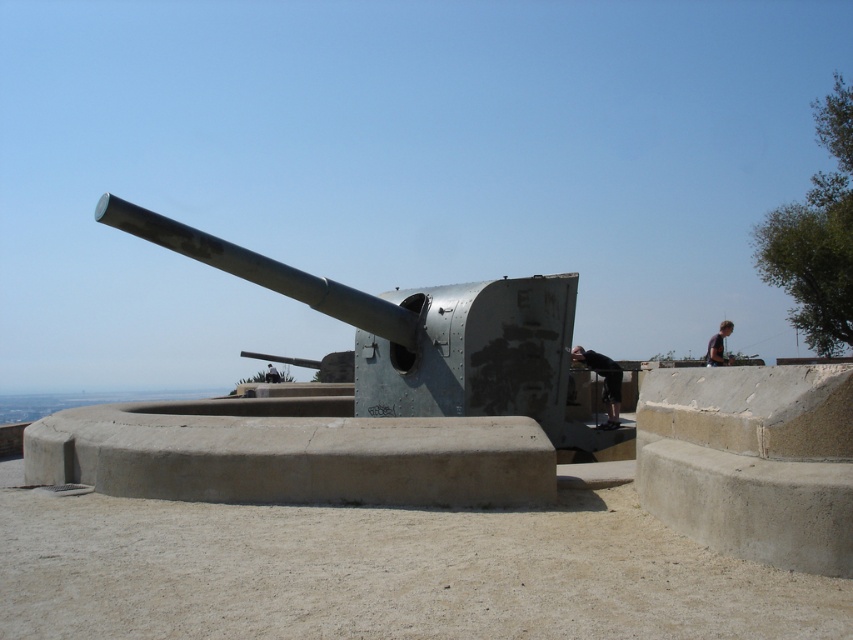
Which is more to the right, shiny metallic cannon at center or black matte pants at lower center?

black matte pants at lower center

Can you confirm if shiny metallic cannon at center is positioned below black matte pants at lower center?

No, shiny metallic cannon at center is not below black matte pants at lower center.

Is point (213, 253) farther from camera compared to point (605, 397)?

That is False.

Image resolution: width=853 pixels, height=640 pixels. In order to click on shiny metallic cannon at center in this screenshot , I will do `click(418, 332)`.

Describe the element at coordinates (602, 381) in the screenshot. The image size is (853, 640). I see `black matte pants at lower center` at that location.

Is black matte pants at lower center smaller than dark blue shirt at upper right?

Yes.

Where is `black matte pants at lower center`? This screenshot has width=853, height=640. black matte pants at lower center is located at coordinates (602, 381).

Does point (399, 342) lie in front of point (721, 362)?

Yes, point (399, 342) is in front of point (721, 362).

Can you confirm if shiny metallic cannon at center is shorter than dark blue shirt at upper right?

In fact, shiny metallic cannon at center may be taller than dark blue shirt at upper right.

The image size is (853, 640). Identify the location of shiny metallic cannon at center. (418, 332).

This screenshot has width=853, height=640. In order to click on shiny metallic cannon at center in this screenshot , I will do pyautogui.click(x=418, y=332).